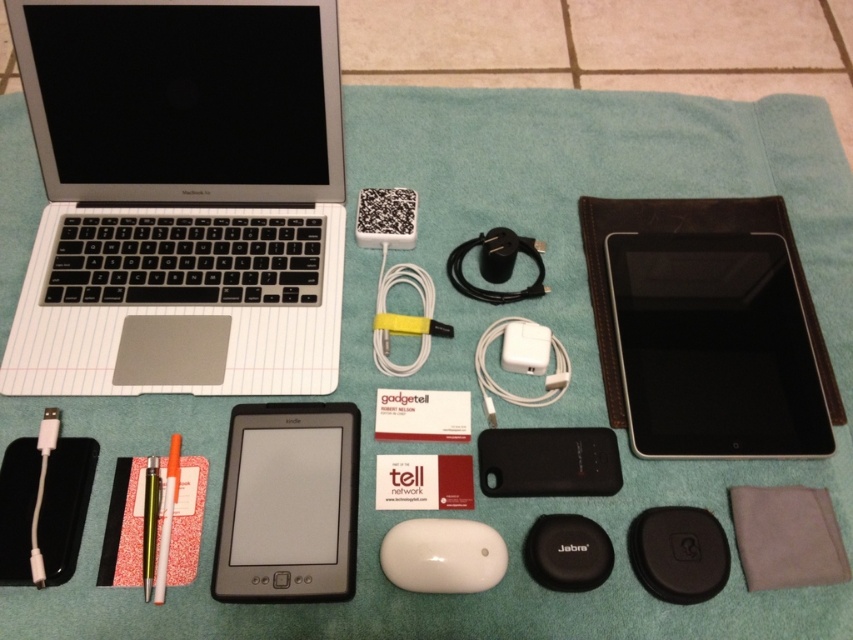
Question: Which of the following is the farthest from the observer?

Choices:
 (A) white matte pen at lower left
 (B) black matte tablet at center

Answer: (A)

Question: Which of the following is the farthest from the observer?

Choices:
 (A) white glossy mouse at center
 (B) black matte tablet at center
 (C) silver/black plastic laptop at upper left
 (D) white matte pen at lower left

Answer: (C)

Question: Is black matte tablet at center to the right of black leather tablet at upper right from the viewer's perspective?

Choices:
 (A) yes
 (B) no

Answer: (B)

Question: Is black leather tablet at upper right below white glossy mouse at center?

Choices:
 (A) yes
 (B) no

Answer: (B)

Question: Which of these objects is positioned closest to the white glossy mouse at center?

Choices:
 (A) white matte pen at lower left
 (B) black matte tablet at center

Answer: (B)

Question: Where is silver/black plastic laptop at upper left located in relation to black leather tablet at upper right in the image?

Choices:
 (A) right
 (B) left

Answer: (B)